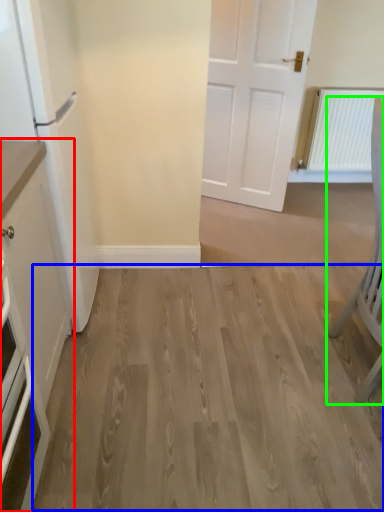
Question: Estimate the real-world distances between objects in this image. Which object is closer to cabinetry (highlighted by a red box), hardwood (highlighted by a blue box) or chair (highlighted by a green box)?

Choices:
 (A) hardwood
 (B) chair

Answer: (A)